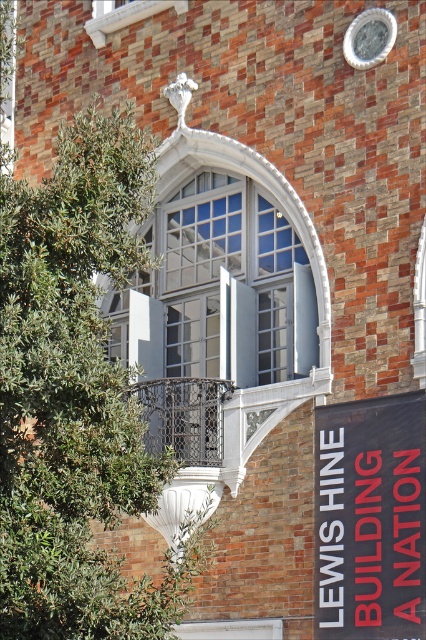
You are standing in front of the building and notice the black fabric banner at lower right and the silver metallic clock at upper center. Which object is nearer to you?

The black fabric banner at lower right is closer to the viewer than the silver metallic clock at upper center.

You are standing in front of the building and notice the black fabric banner at lower right and the silver metallic clock at upper center. Which object is positioned higher on the building?

The silver metallic clock at upper center is positioned higher on the building than the black fabric banner at lower right.

You are an architect examining the building facade. You notice the green leafy tree at left and the black fabric banner at lower right. Which object has a greater width?

The green leafy tree at left has a greater width than the black fabric banner at lower right.